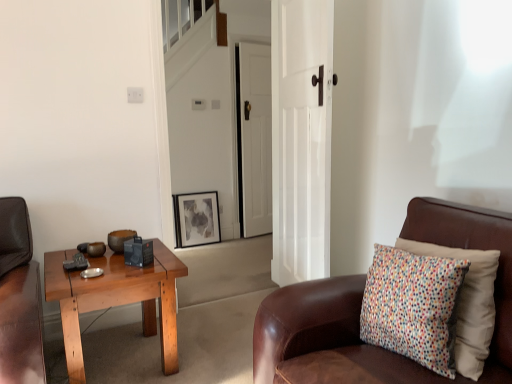
Question: Would you say white wooden door at center, which is the 2th door in front-to-back order, is inside or outside white glossy door at center, placed as the 2th door when sorted from back to front?

Choices:
 (A) inside
 (B) outside

Answer: (B)

Question: Considering the positions of white wooden door at center, which is the 2th door in front-to-back order, and white glossy door at center, placed as the 2th door when sorted from back to front, in the image, is white wooden door at center, which is the 2th door in front-to-back order, bigger or smaller than white glossy door at center, placed as the 2th door when sorted from back to front,?

Choices:
 (A) small
 (B) big

Answer: (A)

Question: Which object is the closest to the wooden coffee table at left?

Choices:
 (A) white wooden door at center, which appears as the first door when viewed from the back
 (B) matte black picture frame at center
 (C) white glossy door at center, positioned as the first door in front-to-back order
 (D) brown leather chair at right
 (E) multicolored fabric pillow at right

Answer: (D)

Question: Considering the real-world distances, which object is farthest from the multicolored fabric pillow at right?

Choices:
 (A) white glossy door at center, placed as the 2th door when sorted from back to front
 (B) wooden coffee table at left
 (C) white wooden door at center, which is the 2th door in front-to-back order
 (D) brown leather chair at right
 (E) matte black picture frame at center

Answer: (C)